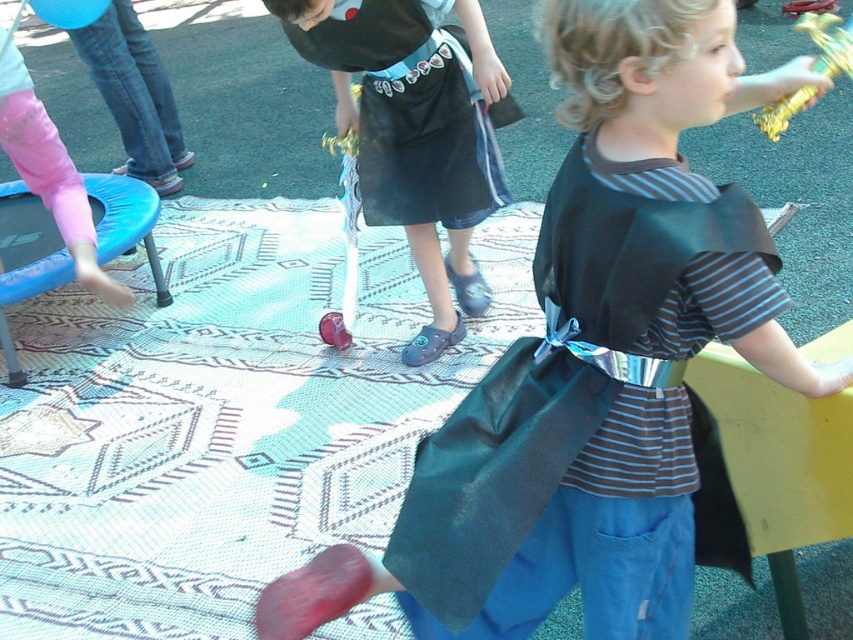
Question: Which object appears farthest from the camera in this image?

Choices:
 (A) blue plastic stool at lower left
 (B) gold metallic wand at upper right
 (C) rubberized red ball at center

Answer: (A)

Question: Estimate the real-world distances between objects in this image. Which object is closer to the blue plastic stool at lower left?

Choices:
 (A) rubberized red ball at center
 (B) shiny blue skirt at center
 (C) gold metallic wand at upper right

Answer: (A)

Question: Is shiny dark green cape at center thinner than gold metallic wand at upper right?

Choices:
 (A) yes
 (B) no

Answer: (B)

Question: Is shiny dark green cape at center below rubberized red ball at center?

Choices:
 (A) no
 (B) yes

Answer: (B)

Question: Can you confirm if shiny blue skirt at center is wider than rubberized red ball at center?

Choices:
 (A) no
 (B) yes

Answer: (B)

Question: Which of the following is the closest to the observer?

Choices:
 (A) [515, 538]
 (B) [816, 36]
 (C) [84, 268]

Answer: (A)